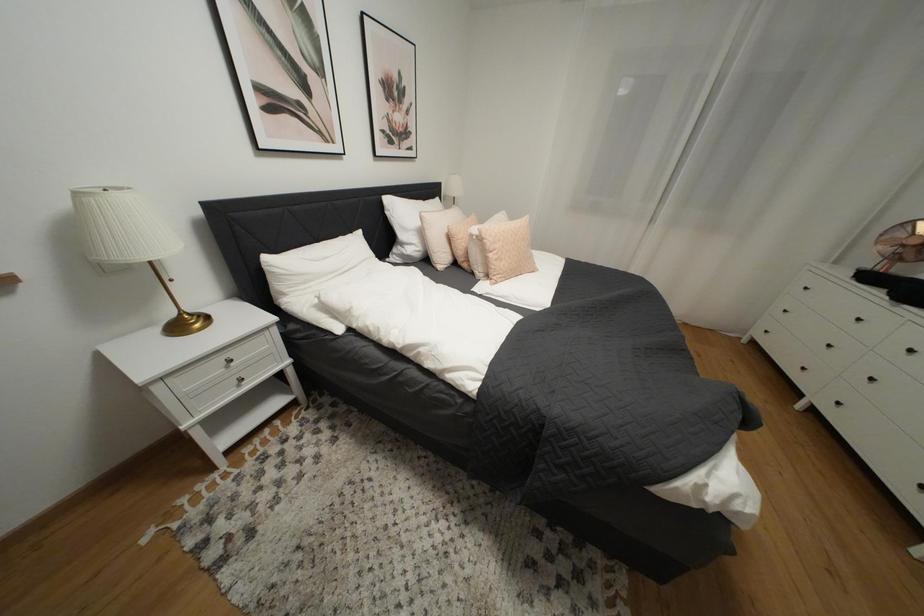
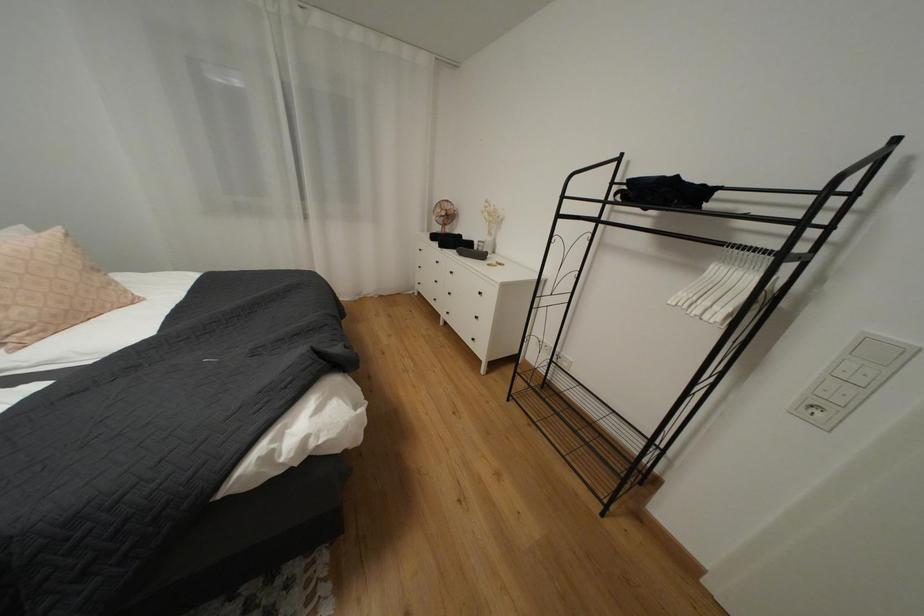
Question: Based on the continuous images, in which direction is the camera rotating? Reply with the corresponding letter.

Choices:
 (A) Left
 (B) Right
 (C) Up
 (D) Down

Answer: (B)